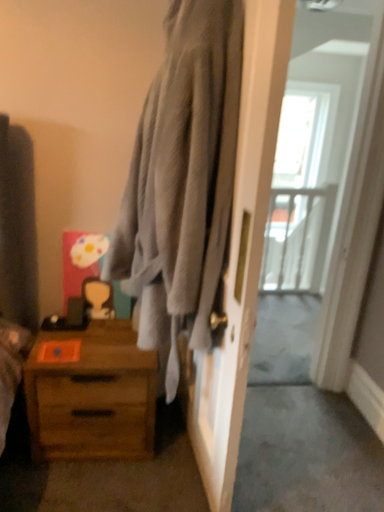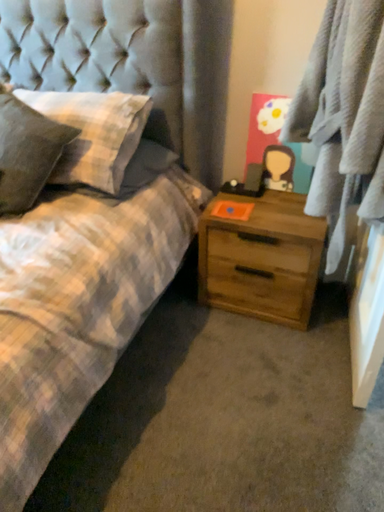
Question: Which way did the camera rotate in the video?

Choices:
 (A) rotated downward
 (B) rotated upward

Answer: (A)